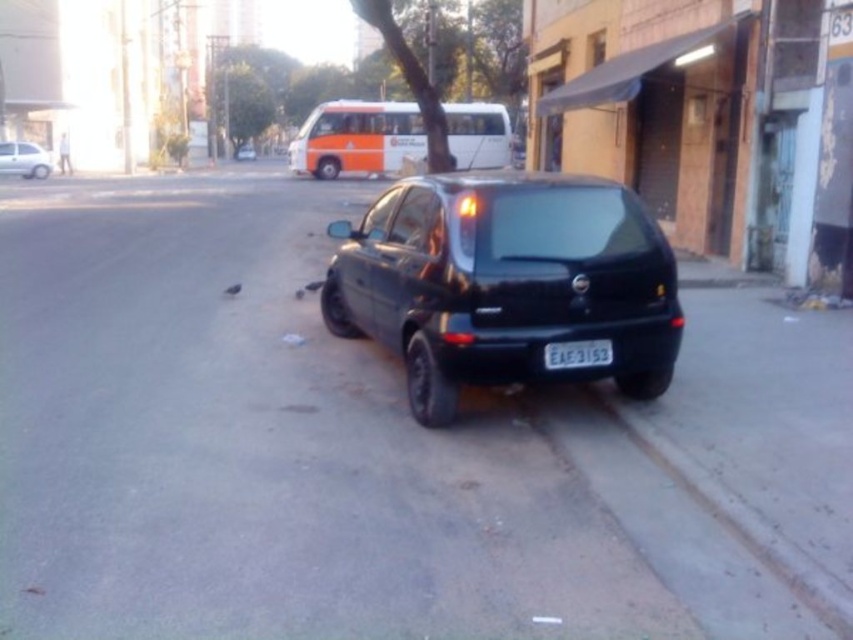
Question: Can you confirm if orange/white bus at upper center is wider than matte white car at left?

Choices:
 (A) yes
 (B) no

Answer: (A)

Question: Does orange/white bus at upper center come in front of black plastic license plate at rear?

Choices:
 (A) yes
 (B) no

Answer: (B)

Question: Which is farther from the orange/white bus at upper center?

Choices:
 (A) black plastic license plate at rear
 (B) glossy black car at center
 (C) black glossy hatchback at center
 (D) matte white car at left

Answer: (B)

Question: Is orange/white bus at upper center further to camera compared to matte white car at left?

Choices:
 (A) no
 (B) yes

Answer: (A)

Question: Which of the following is the closest to the observer?

Choices:
 (A) (612, 358)
 (B) (582, 200)
 (C) (36, 157)

Answer: (A)

Question: Which object is the closest to the orange/white bus at upper center?

Choices:
 (A) black plastic license plate at rear
 (B) matte white car at left
 (C) glossy black car at center
 (D) black glossy hatchback at center

Answer: (B)